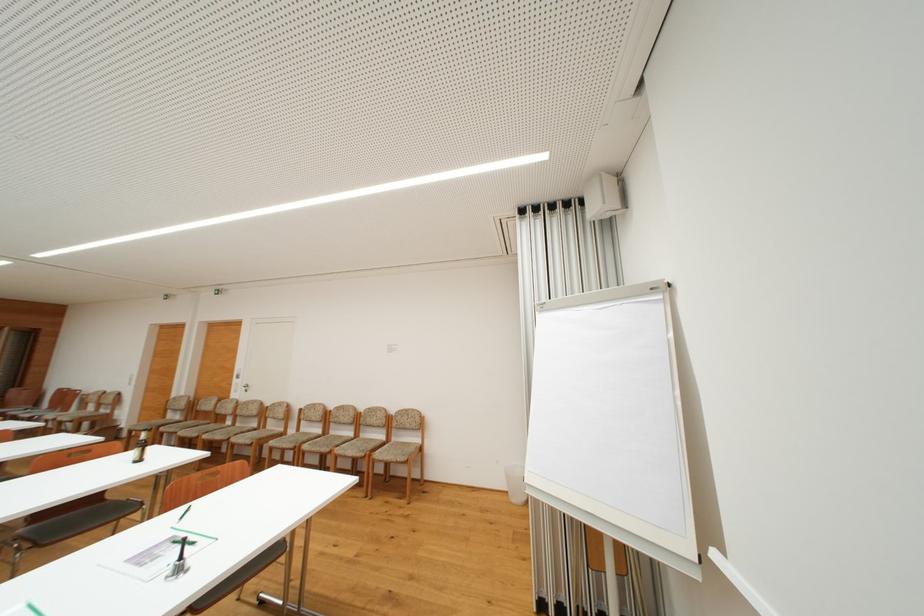
Where is `flipchart paper clamp`? The width and height of the screenshot is (924, 616). flipchart paper clamp is located at coordinates (178, 561).